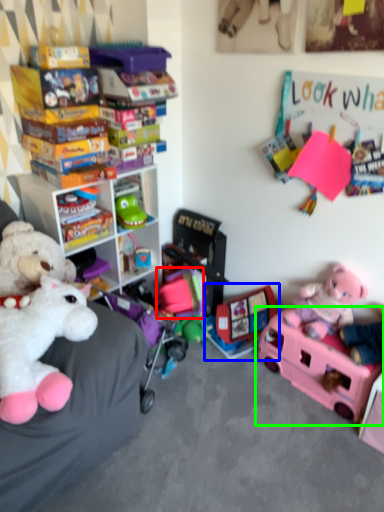
Question: Which is farther away from toy (highlighted by a red box)? toy (highlighted by a blue box) or toy (highlighted by a green box)?

Choices:
 (A) toy
 (B) toy

Answer: (B)